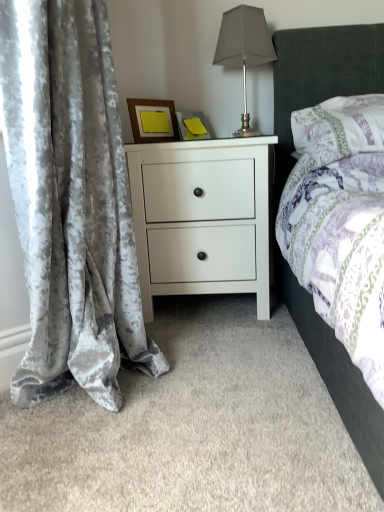
Question: Can you confirm if velvet gray curtain at left is taller than wooden frame at upper center?

Choices:
 (A) no
 (B) yes

Answer: (B)

Question: Is velvet gray curtain at left positioned far away from wooden frame at upper center?

Choices:
 (A) no
 (B) yes

Answer: (A)

Question: Is velvet gray curtain at left outside of wooden frame at upper center?

Choices:
 (A) no
 (B) yes

Answer: (B)

Question: From a real-world perspective, is velvet gray curtain at left positioned over wooden frame at upper center based on gravity?

Choices:
 (A) no
 (B) yes

Answer: (A)

Question: Is the position of velvet gray curtain at left more distant than that of wooden frame at upper center?

Choices:
 (A) no
 (B) yes

Answer: (A)

Question: Can you confirm if velvet gray curtain at left is bigger than wooden frame at upper center?

Choices:
 (A) no
 (B) yes

Answer: (B)

Question: Does wooden frame at upper center have a greater height compared to patterned fabric pillow at upper right?

Choices:
 (A) yes
 (B) no

Answer: (B)

Question: Does wooden frame at upper center appear on the right side of patterned fabric pillow at upper right?

Choices:
 (A) no
 (B) yes

Answer: (A)

Question: From a real-world perspective, is wooden frame at upper center positioned over patterned fabric pillow at upper right based on gravity?

Choices:
 (A) yes
 (B) no

Answer: (A)

Question: Is wooden frame at upper center at the left side of patterned fabric pillow at upper right?

Choices:
 (A) no
 (B) yes

Answer: (B)

Question: Considering the relative sizes of wooden frame at upper center and patterned fabric pillow at upper right in the image provided, is wooden frame at upper center shorter than patterned fabric pillow at upper right?

Choices:
 (A) yes
 (B) no

Answer: (A)

Question: Is wooden frame at upper center far from patterned fabric pillow at upper right?

Choices:
 (A) yes
 (B) no

Answer: (B)

Question: Is satin silver table lamp at upper right placed right next to patterned fabric pillow at upper right?

Choices:
 (A) yes
 (B) no

Answer: (B)